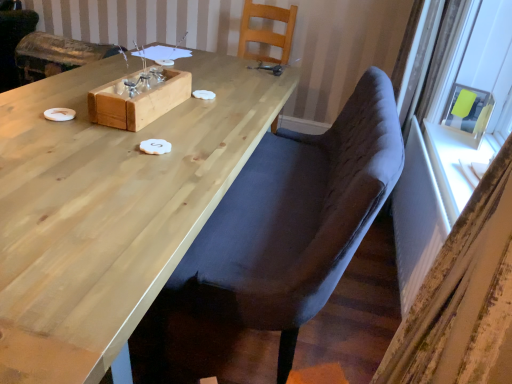
The height and width of the screenshot is (384, 512). I want to click on free space on the front side of yellow paper at upper right, so click(459, 143).